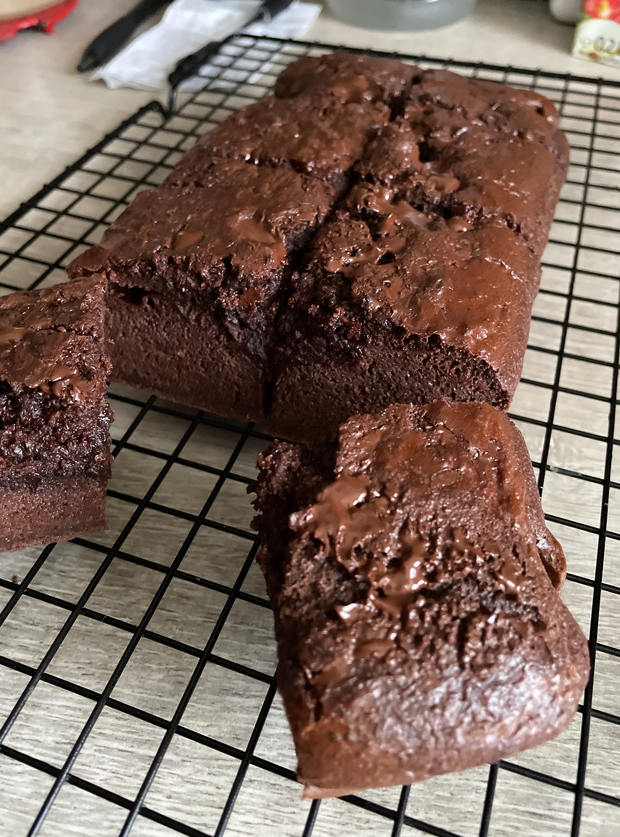
At what (x,y) coordinates should I click in order to perform the action: click on white cup. Please return your answer as a coordinate pair (x, y). Looking at the image, I should click on (568, 8).